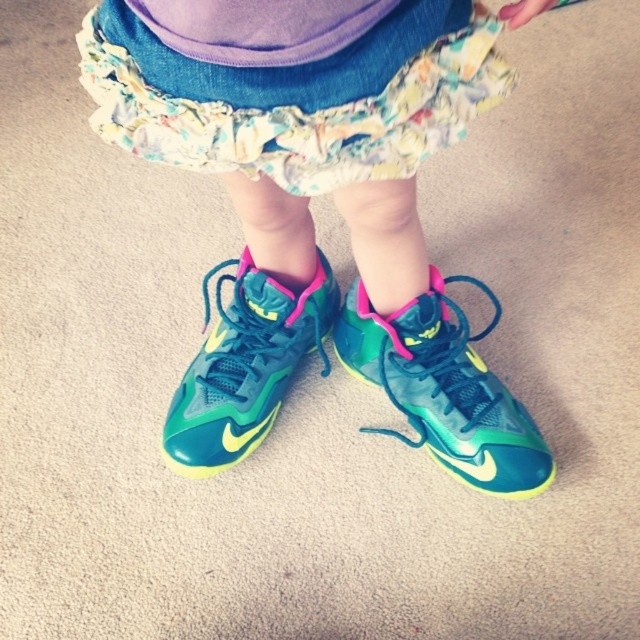
Is point (420, 412) farther from viewer compared to point (166, 417)?

No, (420, 412) is in front of (166, 417).

Between point (509, 416) and point (186, 396), which one is positioned behind?

Positioned behind is point (186, 396).

The height and width of the screenshot is (640, 640). I want to click on glossy synthetic shoe at center, so click(x=444, y=387).

Does shiny teal sneakers at center appear under glossy synthetic shoe at center?

Actually, shiny teal sneakers at center is above glossy synthetic shoe at center.

Who is more forward, (376, 339) or (392, 385)?

Point (392, 385) is in front.

Locate an element on the screen. The height and width of the screenshot is (640, 640). shiny teal sneakers at center is located at coordinates (308, 200).

Looking at this image, is shiny teal sneakers at center further to camera compared to neon green mesh shoe at center?

That is False.

Does point (106, 129) come farther from viewer compared to point (244, 444)?

No.

Locate an element on the screen. The width and height of the screenshot is (640, 640). shiny teal sneakers at center is located at coordinates (308, 200).